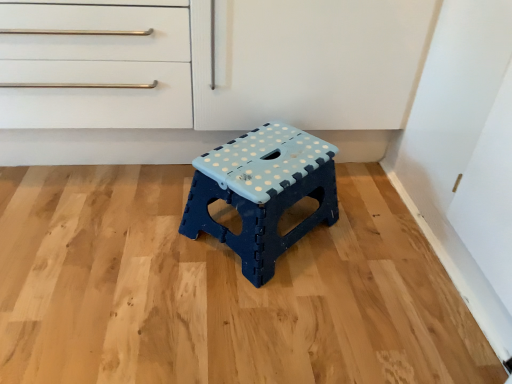
Locate an element on the screen. The image size is (512, 384). free space above light brown wood at center (from a real-world perspective) is located at coordinates (177, 240).